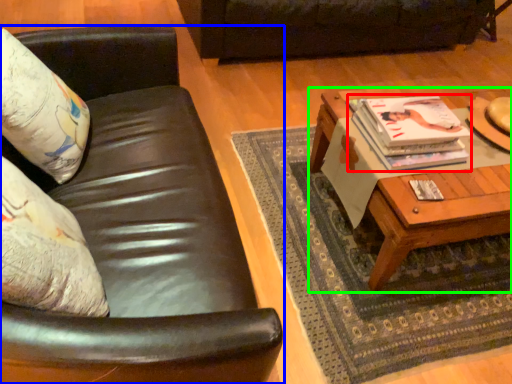
Question: Considering the real-world distances, which object is farthest from magazine (highlighted by a red box)? studio couch (highlighted by a blue box) or coffee table (highlighted by a green box)?

Choices:
 (A) studio couch
 (B) coffee table

Answer: (A)